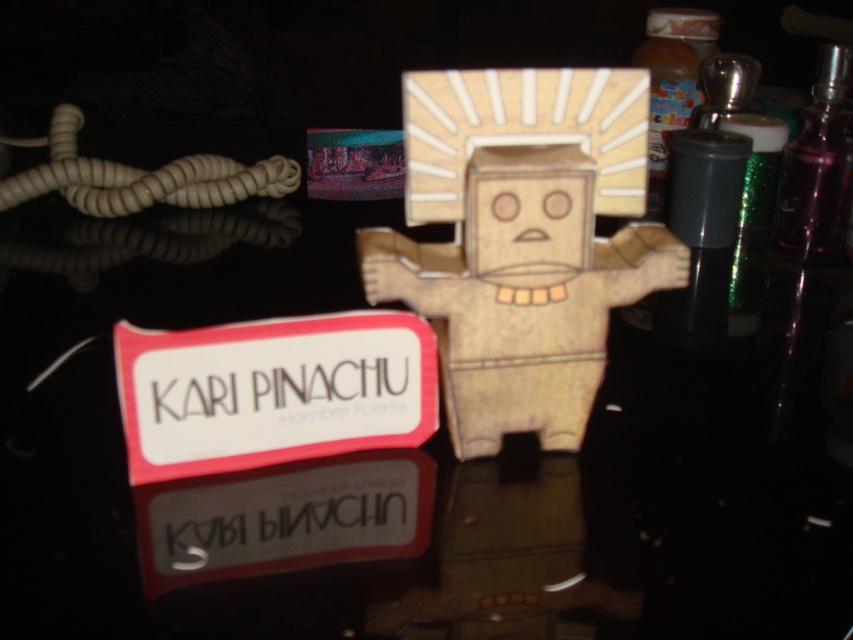
Is wooden figure at center thinner than metallic purple bottle at upper right?

No, wooden figure at center is not thinner than metallic purple bottle at upper right.

Who is taller, wooden figure at center or metallic purple bottle at upper right?

metallic purple bottle at upper right

Is point (524, 376) positioned in front of point (780, 252)?

Yes, it is.

Where is `wooden figure at center`? The image size is (853, 640). wooden figure at center is located at coordinates (521, 241).